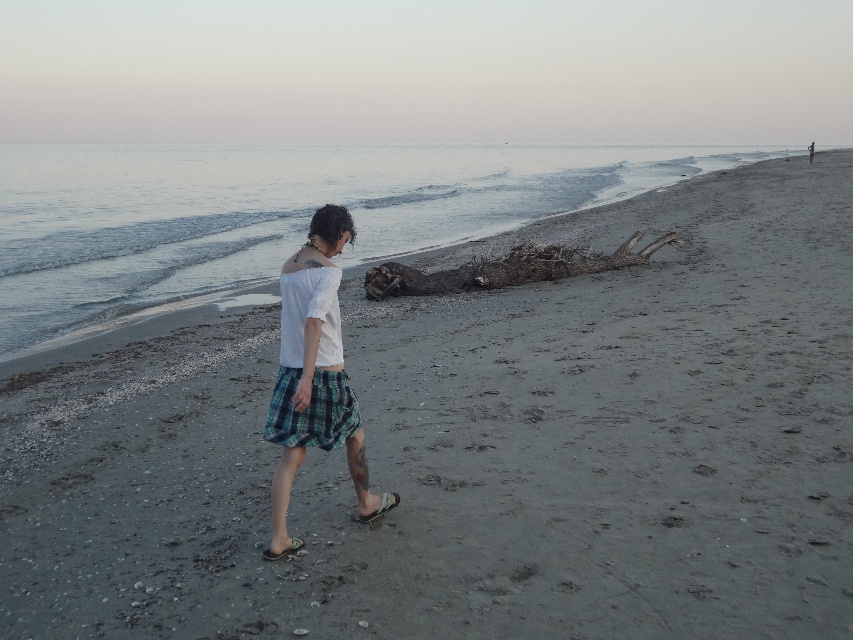
Does white cotton shirt at center have a larger size compared to plaid fabric skirt at center?

Yes, white cotton shirt at center is bigger than plaid fabric skirt at center.

Does white cotton shirt at center lie in front of plaid fabric skirt at center?

That is True.

Find the location of a particular element. The image size is (853, 640). white cotton shirt at center is located at coordinates (x=312, y=369).

Where is `white cotton shirt at center`? The width and height of the screenshot is (853, 640). white cotton shirt at center is located at coordinates (312, 369).

Does point (323, 376) come closer to viewer compared to point (299, 547)?

Yes, it is.

Which is in front, point (285, 403) or point (270, 552)?

Point (270, 552) is in front.

Identify the location of white cotton shirt at center. (x=312, y=369).

Is point (335, 413) less distant than point (811, 147)?

Yes.

Who is more forward, (323, 432) or (811, 160)?

Point (323, 432) is more forward.

Find the location of a particular element. plaid fabric skirt at center is located at coordinates (312, 410).